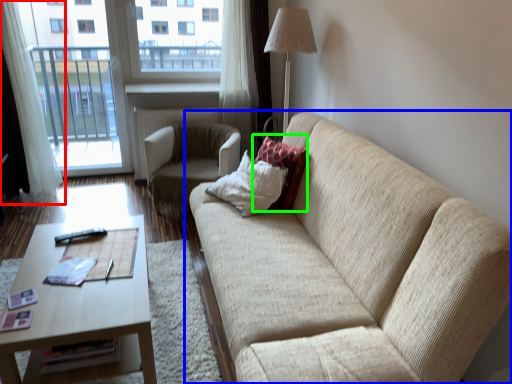
Question: Which object is the farthest from curtain (highlighted by a red box)? Choose among these: studio couch (highlighted by a blue box) or pillow (highlighted by a green box).

Choices:
 (A) studio couch
 (B) pillow

Answer: (A)